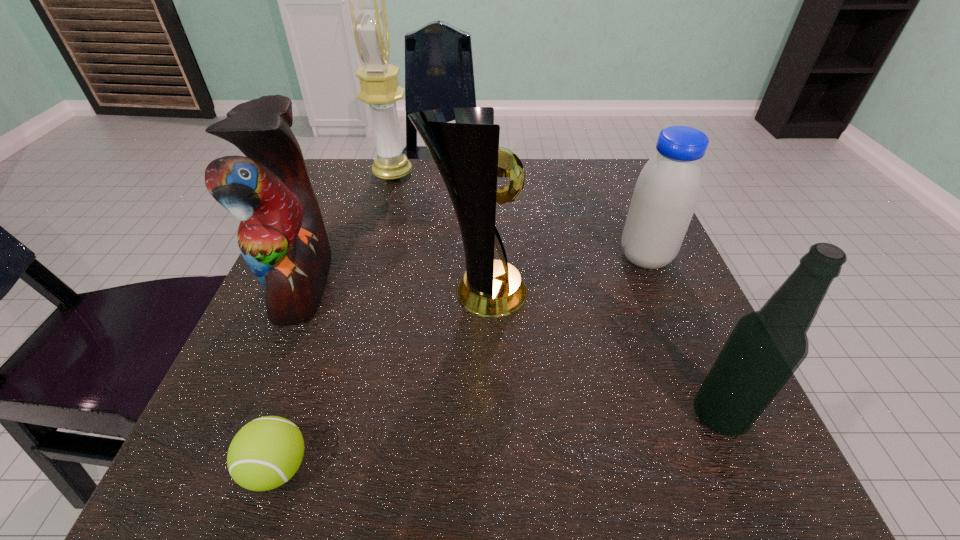
Locate an element on the screen. Image resolution: width=960 pixels, height=540 pixels. free space between the third object from right to left and the parrot is located at coordinates (390, 287).

Point out which object is positioned as the second nearest to the nearer award. Please provide its 2D coordinates. Your answer should be formatted as a tuple, i.e. [(x, y)], where the tuple contains the x and y coordinates of a point satisfying the conditions above.

[(667, 191)]

Identify the location of object that is the fifth closest to the parrot. This screenshot has width=960, height=540. (766, 347).

Where is `free space that satisfies the following two spatial constraints: 1. on the back side of the alcohol; 2. at the front of the nearer award, where the globe is visible`? This screenshot has height=540, width=960. free space that satisfies the following two spatial constraints: 1. on the back side of the alcohol; 2. at the front of the nearer award, where the globe is visible is located at coordinates (665, 292).

Image resolution: width=960 pixels, height=540 pixels. In order to click on free location that satisfies the following two spatial constraints: 1. on the front-facing side of the left award; 2. on the front side of the shortest object in this screenshot , I will do `click(310, 468)`.

I want to click on free point that satisfies the following two spatial constraints: 1. on the back side of the tennis ball; 2. at the face of the parrot, so click(340, 283).

You are a GUI agent. You are given a task and a screenshot of the screen. Output one action in this format:
    pyautogui.click(x=<x>, y=<y>)
    Task: Click on the vacant space that satisfies the following two spatial constraints: 1. on the front-facing side of the left award; 2. on the left side of the fifth tallest object
    
    Given the screenshot: What is the action you would take?
    pyautogui.click(x=370, y=258)

The width and height of the screenshot is (960, 540). What are the coordinates of `free space that satisfies the following two spatial constraints: 1. on the front-facing side of the alcohol; 2. on the left side of the left award` in the screenshot? It's located at (324, 416).

You are a GUI agent. You are given a task and a screenshot of the screen. Output one action in this format:
    pyautogui.click(x=<x>, y=<y>)
    Task: Click on the vacant space that satisfies the following two spatial constraints: 1. at the front of the alcohol, where the globe is visible; 2. on the left side of the fourth object from left to right
    
    Given the screenshot: What is the action you would take?
    pyautogui.click(x=477, y=416)

Identify the location of free location that satisfies the following two spatial constraints: 1. at the face of the parrot; 2. on the left side of the tennis ball. The height and width of the screenshot is (540, 960). (224, 468).